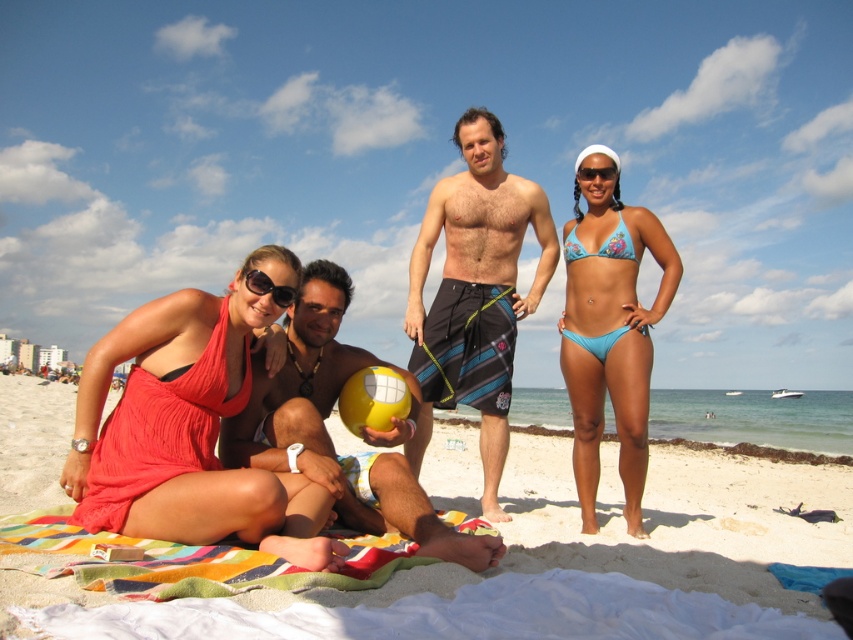
Between point (339, 541) and point (186, 394), which one is positioned in front?

Point (339, 541)

Is point (129, 355) farther from camera compared to point (120, 497)?

Yes, it is behind point (120, 497).

Does point (251, 257) come behind point (154, 483)?

Yes.

Locate an element on the screen. This screenshot has height=640, width=853. matte red dress at lower left is located at coordinates (189, 428).

Which of these two, turquoise floral bikini at right or blue floral bikini at upper right, stands taller?

turquoise floral bikini at right

Can you confirm if turquoise floral bikini at right is taller than blue floral bikini at upper right?

Yes.

Does point (579, 257) come farther from viewer compared to point (618, 216)?

That is True.

Image resolution: width=853 pixels, height=640 pixels. What are the coordinates of `turquoise floral bikini at right` in the screenshot? It's located at (601, 244).

Is the position of beach towel at lower center less distant than that of black plastic sunglasses at center?

Yes, it is.

Is point (840, 522) farther from camera compared to point (271, 285)?

Yes, it is.

Find the location of `beach towel at lower center`. beach towel at lower center is located at coordinates pyautogui.click(x=590, y=548).